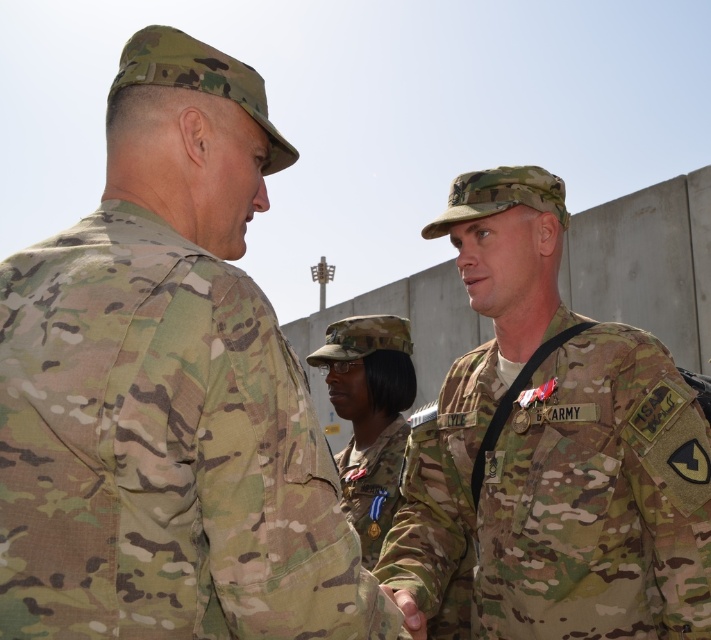
Question: Which object is closer to the camera taking this photo?

Choices:
 (A) camouflage fabric uniform at center
 (B) camo uniform at center
 (C) multicam uniform at center

Answer: (C)

Question: Which object appears closest to the camera in this image?

Choices:
 (A) camouflage fabric uniform at center
 (B) multicam uniform at center
 (C) camo uniform at center

Answer: (B)

Question: From the image, what is the correct spatial relationship of camo uniform at center in relation to camouflage fabric uniform at center?

Choices:
 (A) right
 (B) left

Answer: (A)

Question: Which point is closer to the camera?

Choices:
 (A) (343, 452)
 (B) (530, 468)
 (C) (129, 316)

Answer: (C)

Question: Can you confirm if multicam uniform at center is wider than camouflage fabric uniform at center?

Choices:
 (A) no
 (B) yes

Answer: (B)

Question: Is camo uniform at center bigger than camouflage fabric uniform at center?

Choices:
 (A) yes
 (B) no

Answer: (A)